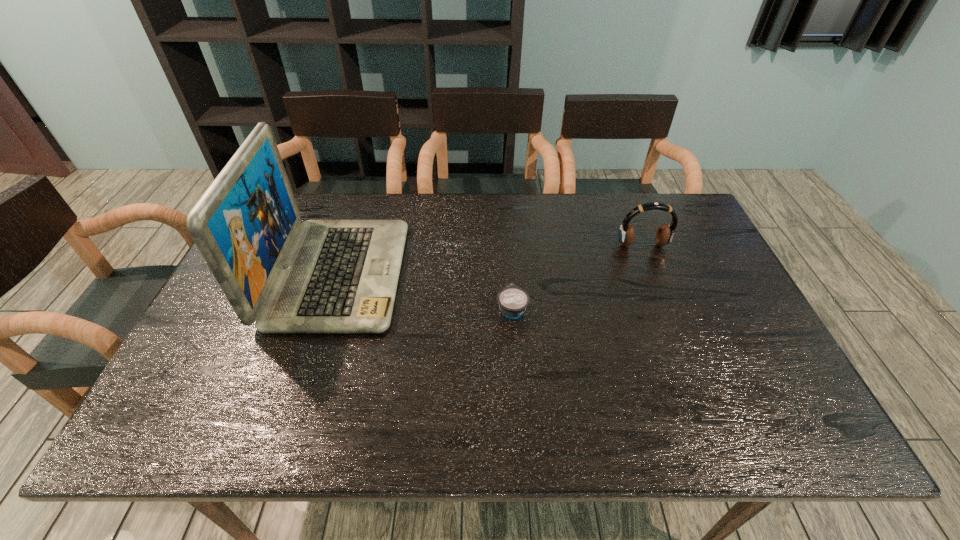
Find the location of `laptop computer`. laptop computer is located at coordinates (339, 276).

This screenshot has width=960, height=540. Identify the location of the leftmost object. (339, 276).

This screenshot has height=540, width=960. In order to click on headset in this screenshot , I will do `click(664, 235)`.

I want to click on the rightmost object, so click(664, 235).

Find the location of a particular element. The height and width of the screenshot is (540, 960). yogurt is located at coordinates (512, 300).

At what (x,y) coordinates should I click in order to perform the action: click on the shortest object. Please return your answer as a coordinate pair (x, y). Looking at the image, I should click on (512, 300).

Locate an element on the screen. vacant space situated on the screen of the laptop computer is located at coordinates (421, 274).

Locate an element on the screen. The width and height of the screenshot is (960, 540). free spot located on the ear cup of the second shortest object is located at coordinates (677, 333).

What are the coordinates of `free space located on the front of the yogurt` in the screenshot? It's located at (516, 352).

At what (x,y) coordinates should I click in order to perform the action: click on object present at the far edge. Please return your answer as a coordinate pair (x, y). Image resolution: width=960 pixels, height=540 pixels. Looking at the image, I should click on click(x=339, y=276).